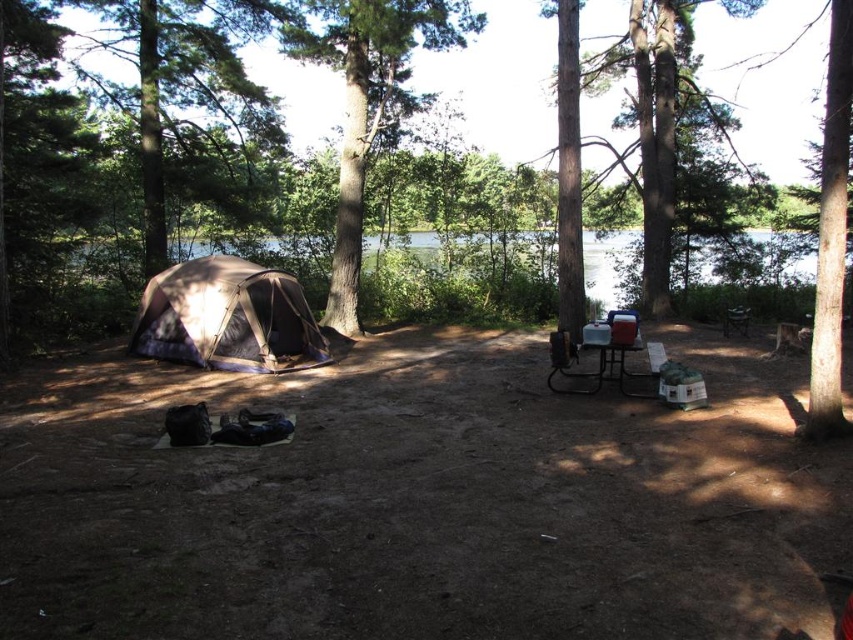
You are standing at the campsite and want to move from the point at coordinates point (228, 324) to the point at coordinates point (744, 317). Which direction should you move to get closer to your destination?

To move from point (228, 324) to point (744, 317), you should move upward since the destination point is above the starting point.

You are a hiker who wants to take a photo of the brown textured tree at upper center. Where should you position yourself to capture it in the best possible view?

To capture the brown textured tree at upper center in the best possible view, position yourself at point (654, 141).